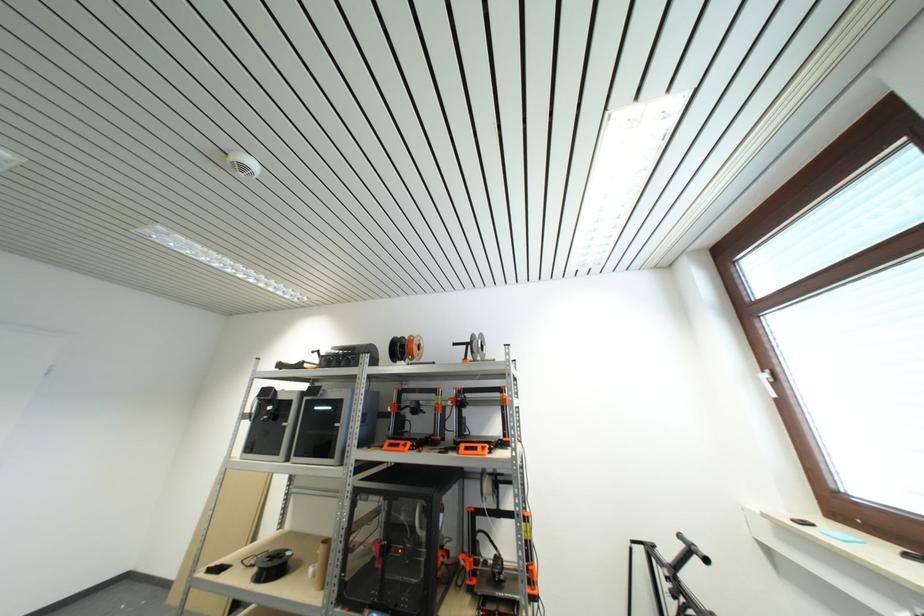
Where would you lift the clear filament spool? Please return your answer as a coordinate pair (x, y).

(242, 164)